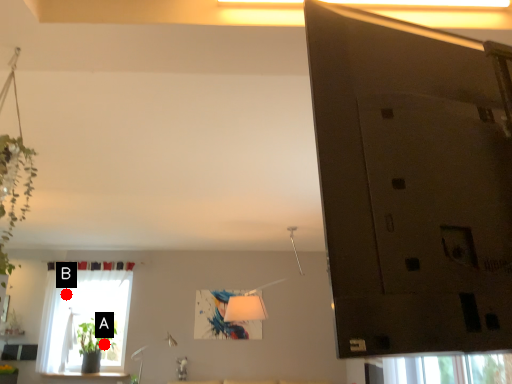
Question: Two points are circled on the image, labeled by A and B beside each circle. Among these points, which one is nearest to the camera?

Choices:
 (A) A is closer
 (B) B is closer

Answer: (A)